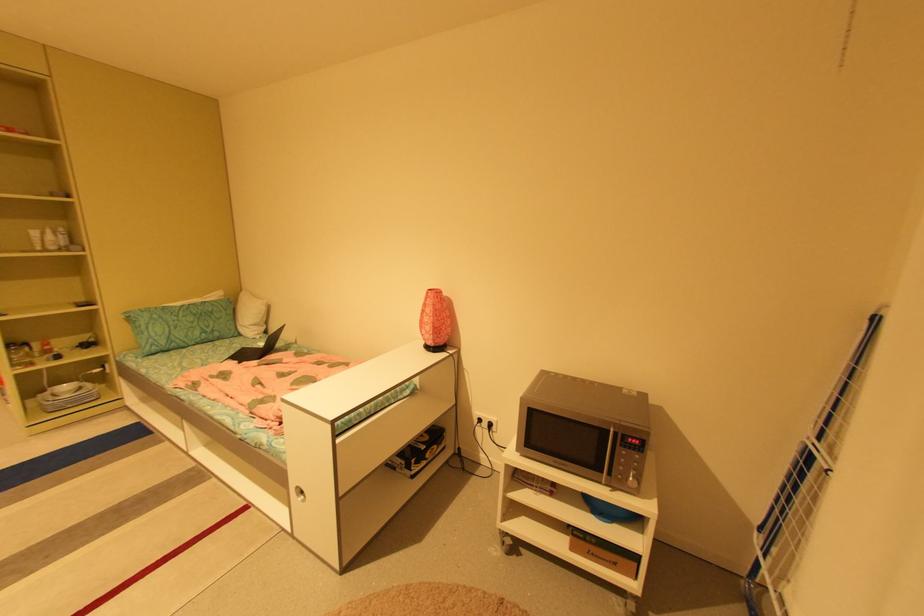
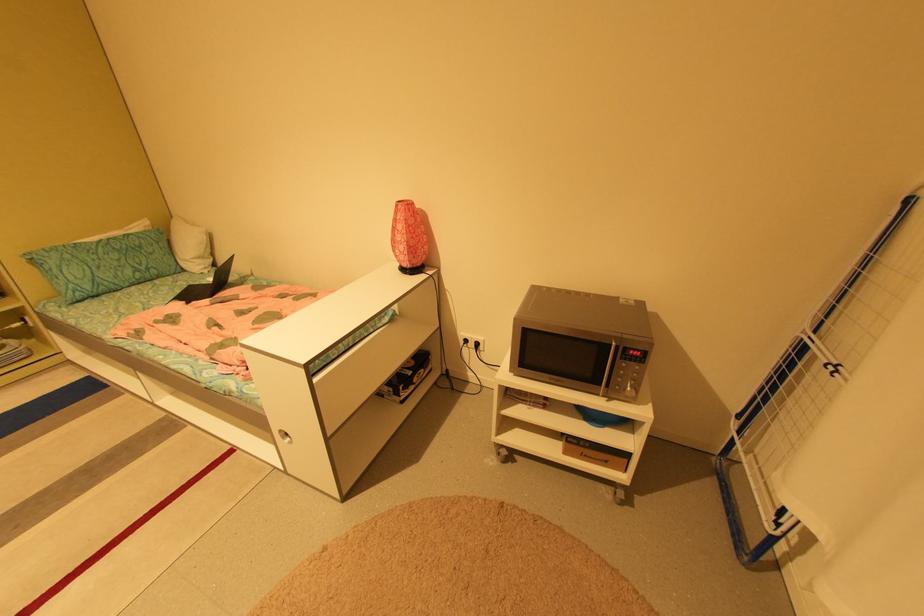
Where in the second image is the point corresponding to [216,310] from the first image?

(142, 244)